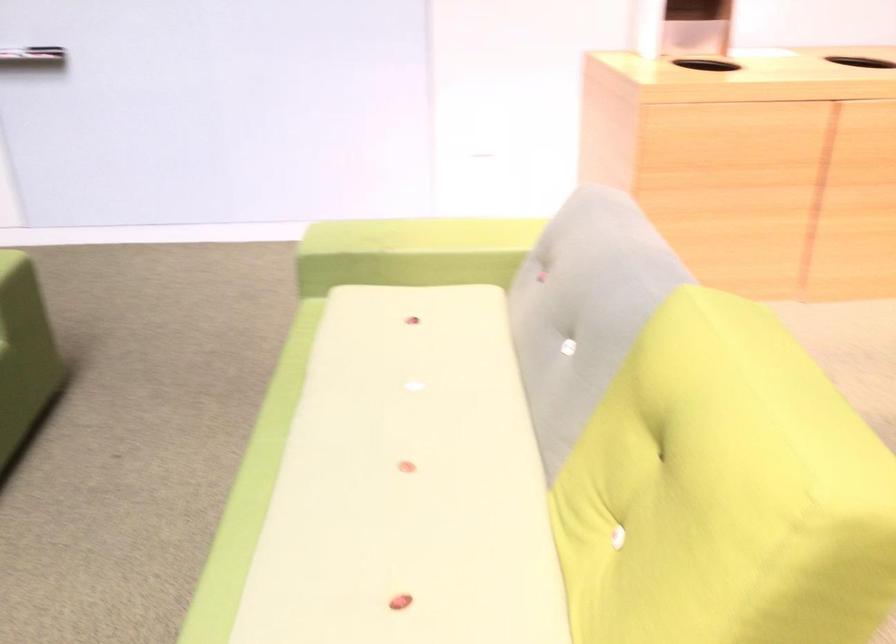
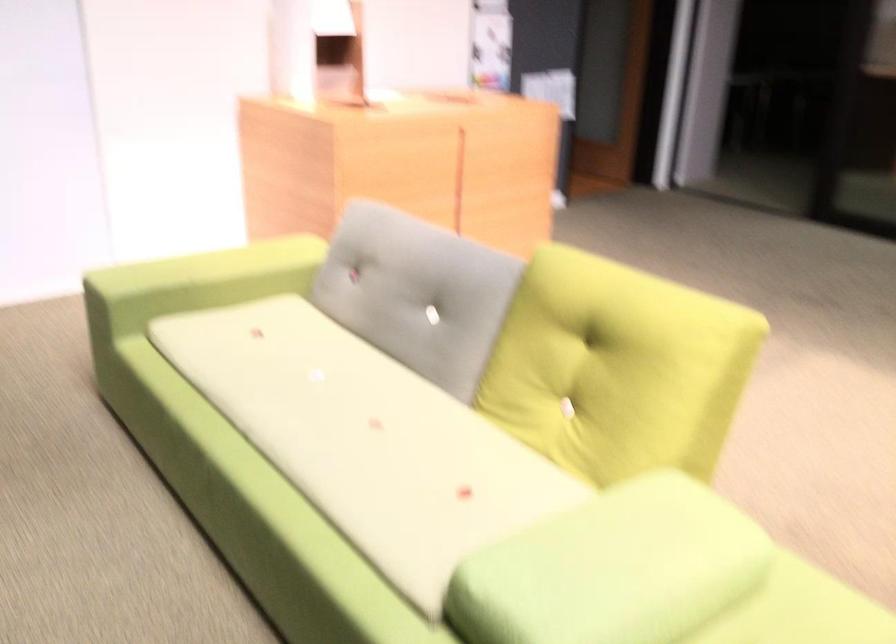
Where in the second image is the point corresponding to (567,317) from the first image?

(417, 292)